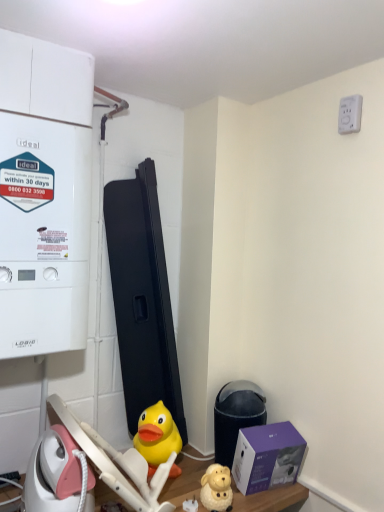
Question: Is point (251, 386) closer or farther from the camera than point (236, 459)?

Choices:
 (A) farther
 (B) closer

Answer: (A)

Question: From a real-world perspective, is black plastic water heater at lower right positioned above or below purple matte box at lower right?

Choices:
 (A) below
 (B) above

Answer: (B)

Question: Which object is positioned closest to the white plastic electric outlet at upper right?

Choices:
 (A) matte yellow plastic dog at lower center, the 2th toy from the left
 (B) white matte boiler at left
 (C) black plastic water heater at lower right
 (D) yellow rubber duck at center, the 1th toy when ordered from back to front
 (E) purple matte box at lower right

Answer: (B)

Question: Based on their relative distances, which object is nearer to the black plastic water heater at lower right?

Choices:
 (A) white plastic electric outlet at upper right
 (B) yellow rubber duck at center, which is the second toy in front-to-back order
 (C) white matte boiler at left
 (D) matte yellow plastic dog at lower center, which appears as the 1th toy when viewed from the front
 (E) purple matte box at lower right

Answer: (E)